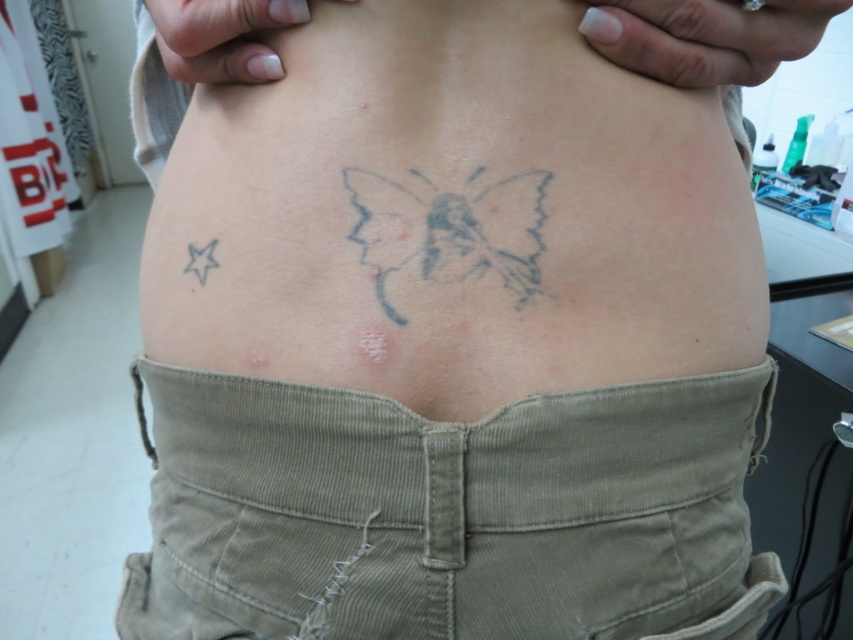
Question: Does corduroy fabric at center appear on the right side of gray ink butterfly at center?

Choices:
 (A) no
 (B) yes

Answer: (A)

Question: Is corduroy fabric at center positioned behind gray ink butterfly at center?

Choices:
 (A) no
 (B) yes

Answer: (A)

Question: Which object is closer to the camera taking this photo?

Choices:
 (A) gray ink butterfly at center
 (B) corduroy fabric at center

Answer: (B)

Question: Which point is farther to the camera?

Choices:
 (A) (450, 273)
 (B) (331, 522)

Answer: (B)

Question: Can you confirm if corduroy fabric at center is wider than gray ink butterfly at center?

Choices:
 (A) yes
 (B) no

Answer: (A)